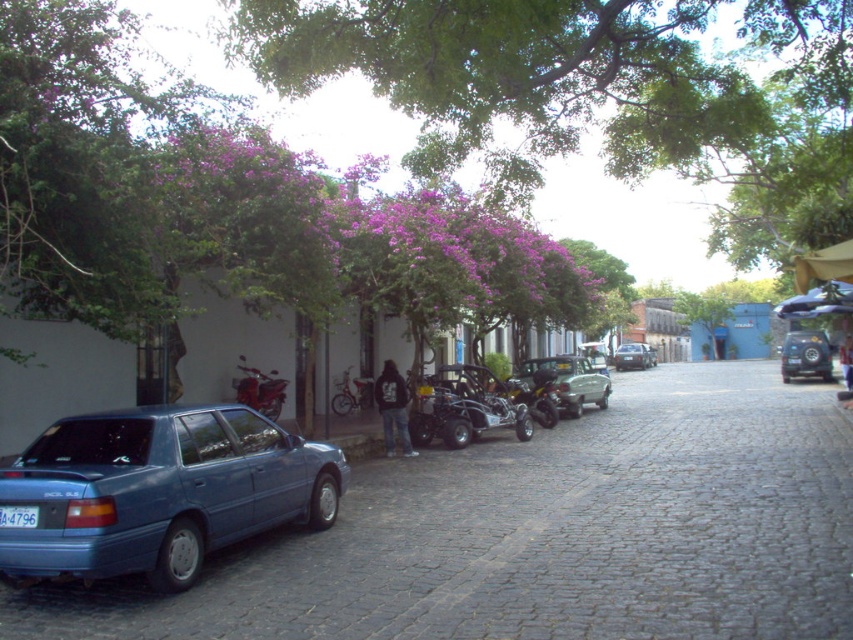
Question: Among these objects, which one is farthest from the camera?

Choices:
 (A) metallic silver go-kart at center
 (B) green leafy tree at center

Answer: (B)

Question: Which of the following is the closest to the observer?

Choices:
 (A) (119, 560)
 (B) (550, 374)
 (C) (10, 520)
 (D) (730, 305)

Answer: (A)

Question: Which of the following is the closest to the observer?

Choices:
 (A) blue plastic license plate at lower left
 (B) shiny red motorcycle at center-left

Answer: (A)

Question: Is green leafy tree at center positioned behind blue plastic license plate at lower left?

Choices:
 (A) yes
 (B) no

Answer: (A)

Question: Where is shiny black suv at center right located in relation to shiny red motorcycle at center-left in the image?

Choices:
 (A) above
 (B) below

Answer: (A)

Question: Can you confirm if purple leafy tree at upper center is positioned below matte blue sedan at lower left?

Choices:
 (A) no
 (B) yes

Answer: (A)